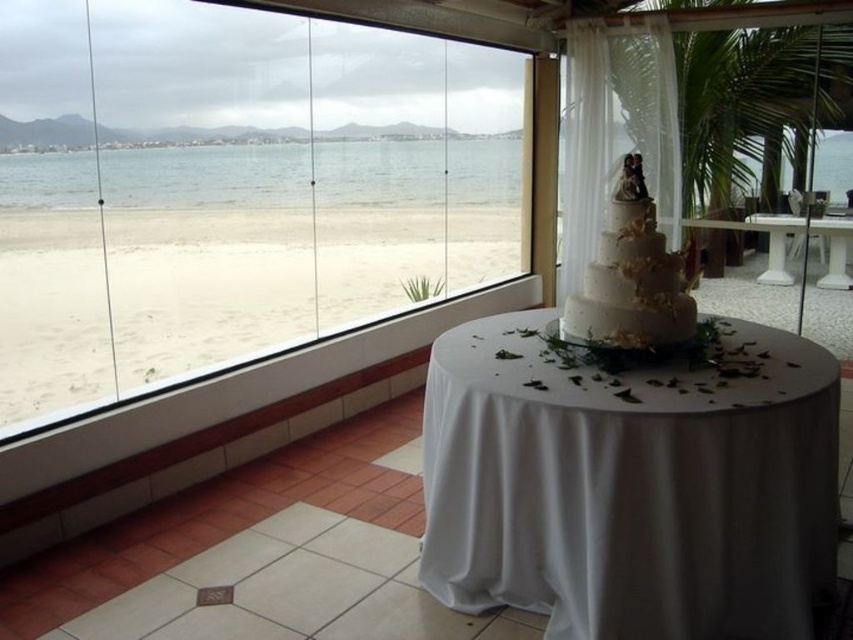
You are a guest at a wedding and you want to see both the transparent glass window at center and the clear water at center from your current position. Which object is taller?

The transparent glass window at center is much taller than the clear water at center.